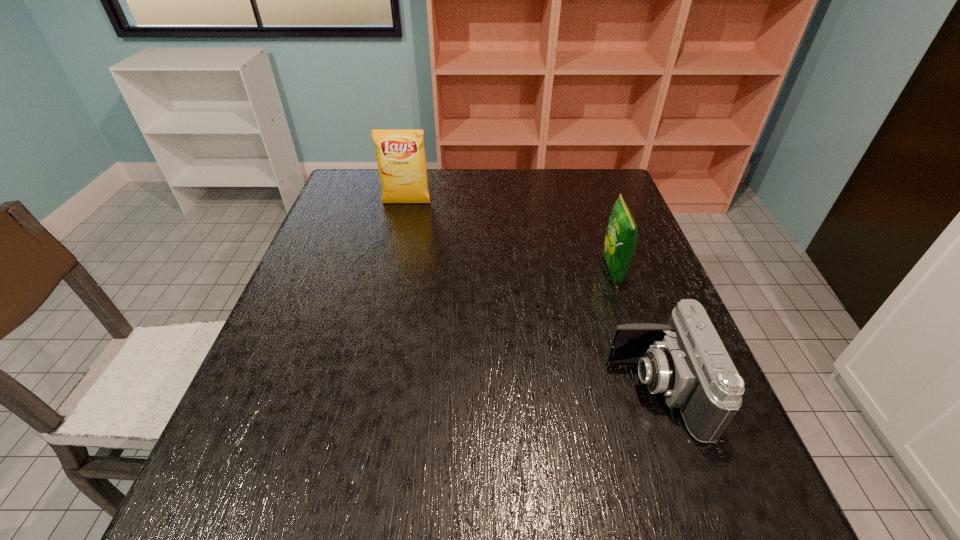
I want to click on the leftmost object, so click(x=400, y=153).

Identify the location of the farther crisp (potato chip). The height and width of the screenshot is (540, 960). (400, 153).

Locate an element on the screen. This screenshot has width=960, height=540. the nearer crisp (potato chip) is located at coordinates (621, 238).

What are the coordinates of `the second farthest object` in the screenshot? It's located at (621, 238).

Where is `the nearest object`? the nearest object is located at coordinates (685, 360).

Where is `the shortest object`? the shortest object is located at coordinates (685, 360).

The width and height of the screenshot is (960, 540). I want to click on vacant space located 0.170m on the front of the farther crisp (potato chip) with the logo, so click(397, 242).

At what (x,y) coordinates should I click in order to perform the action: click on free region located on the front-facing side of the right crisp (potato chip). Please return your answer as a coordinate pair (x, y). The image size is (960, 540). Looking at the image, I should click on (480, 272).

I want to click on free spot located 0.310m on the front-facing side of the right crisp (potato chip), so click(480, 272).

Where is `vacant point located 0.110m on the front-facing side of the right crisp (potato chip)`? vacant point located 0.110m on the front-facing side of the right crisp (potato chip) is located at coordinates (559, 272).